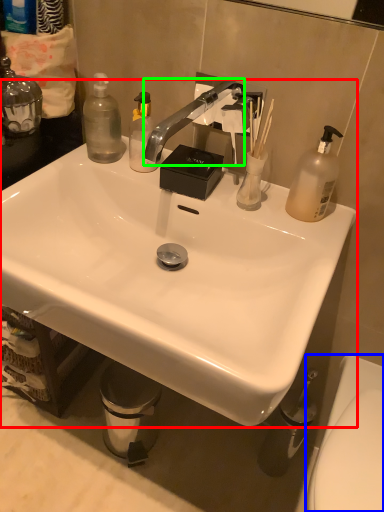
Question: Which object is positioned closest to sink (highlighted by a red box)? Select from toilet (highlighted by a blue box) and faucet (highlighted by a green box).

Choices:
 (A) toilet
 (B) faucet

Answer: (B)